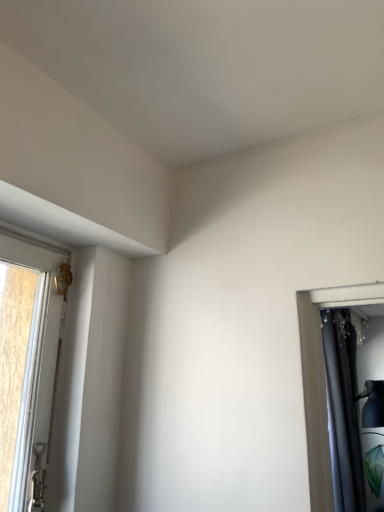
The height and width of the screenshot is (512, 384). I want to click on matte gray curtain at right, so click(x=322, y=379).

Describe the element at coordinates (322, 379) in the screenshot. The width and height of the screenshot is (384, 512). I see `matte gray curtain at right` at that location.

At what (x,y) coordinates should I click in order to perform the action: click on matte gray curtain at right. Please return your answer as a coordinate pair (x, y). Image resolution: width=384 pixels, height=512 pixels. Looking at the image, I should click on (322, 379).